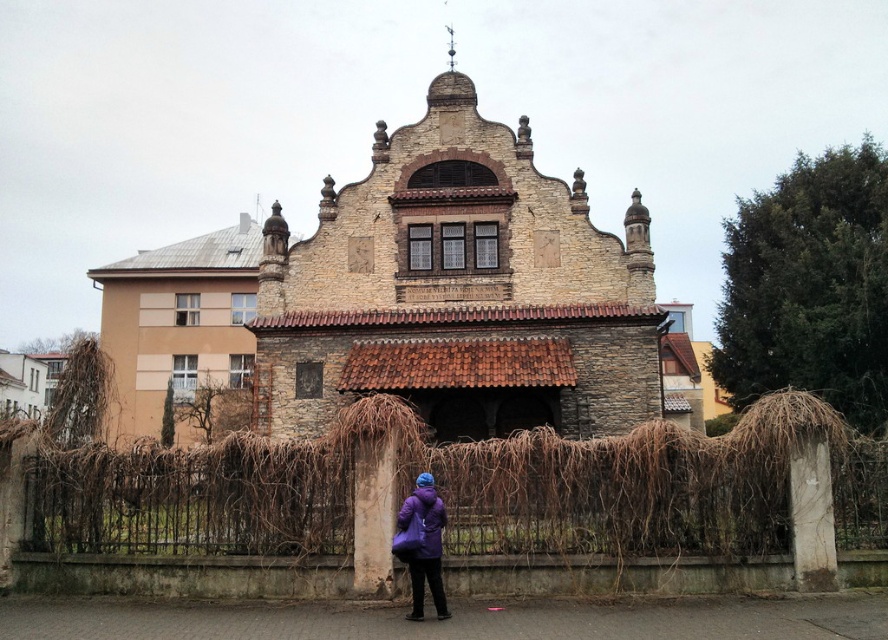
You are a photographer planning to capture the stone textured church at center and the purple synthetic coat at lower center in a single frame. Based on their sizes, which object should you focus on to ensure both are clearly visible in the photo?

Since the stone textured church at center is wider than the purple synthetic coat at lower center, you should focus on the stone textured church at center to ensure both objects are clearly visible in the photo.